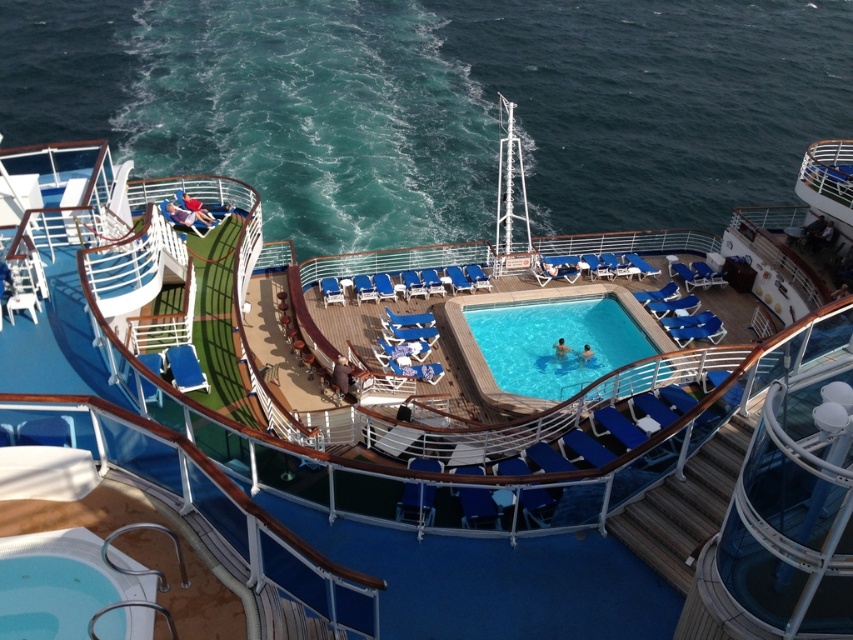
Describe the element at coordinates (440, 104) in the screenshot. I see `clear blue water at upper center` at that location.

Can you confirm if clear blue water at upper center is taller than clear blue water at center?

Yes.

Find the location of a particular element. clear blue water at upper center is located at coordinates (440, 104).

The height and width of the screenshot is (640, 853). I want to click on clear blue water at upper center, so click(440, 104).